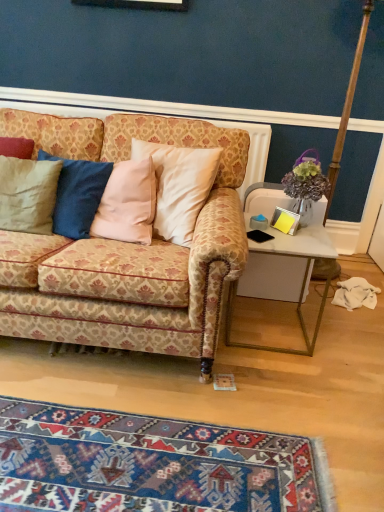
Where is `free space on the front side of white glossy desk at right`? free space on the front side of white glossy desk at right is located at coordinates (276, 380).